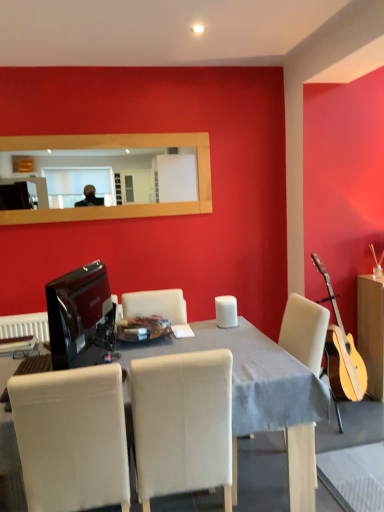
Question: Choose the correct answer: Is white matte speaker at center inside beige fabric chair at center, acting as the 2th chair starting from the left, or outside it?

Choices:
 (A) inside
 (B) outside

Answer: (B)

Question: From the image's perspective, is white matte speaker at center above or below beige fabric chair at center, which is the first chair in right-to-left order?

Choices:
 (A) above
 (B) below

Answer: (A)

Question: Based on their relative distances, which object is farther from the white fabric chair at lower left, the second chair viewed from the right?

Choices:
 (A) wooden frame mirror at upper center
 (B) wooden cabinet at right
 (C) black glossy television at left
 (D) white matte speaker at center
 (E) clear glass plate at center

Answer: (B)

Question: Based on their relative distances, which object is farther from the wooden frame mirror at upper center?

Choices:
 (A) white fabric chair at lower left, which is the 1th chair in left-to-right order
 (B) wooden cabinet at right
 (C) white matte speaker at center
 (D) light beige fabric table at center
 (E) beige fabric chair at center, which is the first chair in right-to-left order

Answer: (A)